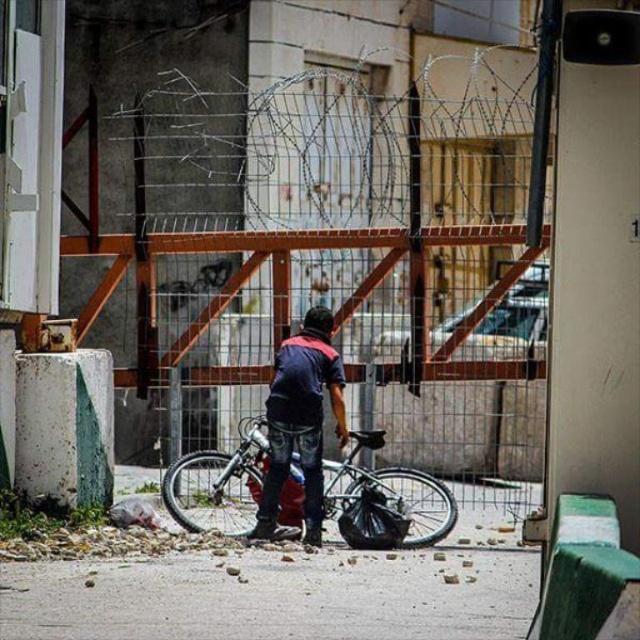
Does metallic silver bicycle at center have a greater height compared to dark blue denim jeans at center?

In fact, metallic silver bicycle at center may be shorter than dark blue denim jeans at center.

Which is more to the left, metallic silver bicycle at center or dark blue denim jeans at center?

Positioned to the left is metallic silver bicycle at center.

Measure the distance between point [380,474] and camera.

Point [380,474] is 40.71 feet away from camera.

Where is `metallic silver bicycle at center`? metallic silver bicycle at center is located at coordinates (220, 483).